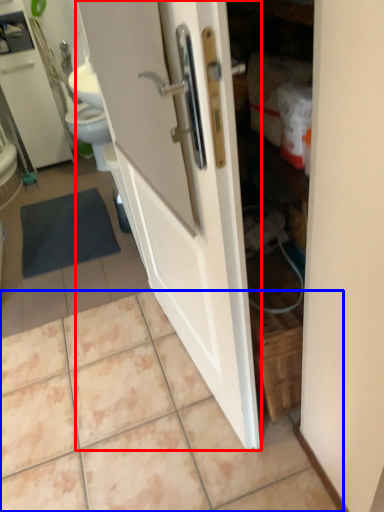
Question: Which point is closer to the camera, door (highlighted by a red box) or ceramic tile (highlighted by a blue box)?

Choices:
 (A) door
 (B) ceramic tile

Answer: (A)